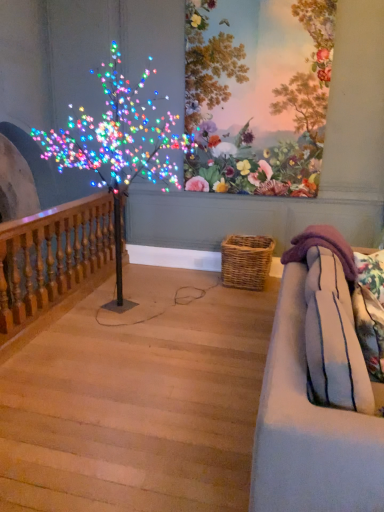
This screenshot has height=512, width=384. I want to click on free area in between wooden baluster at left and woven brown basket at lower center, so pos(148,305).